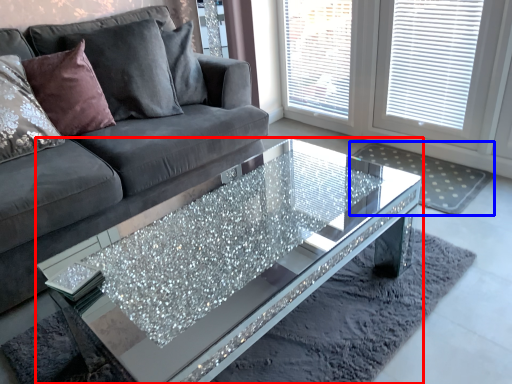
Question: Which point is closer to the camera, coffee table (highlighted by a red box) or mat (highlighted by a blue box)?

Choices:
 (A) coffee table
 (B) mat

Answer: (A)